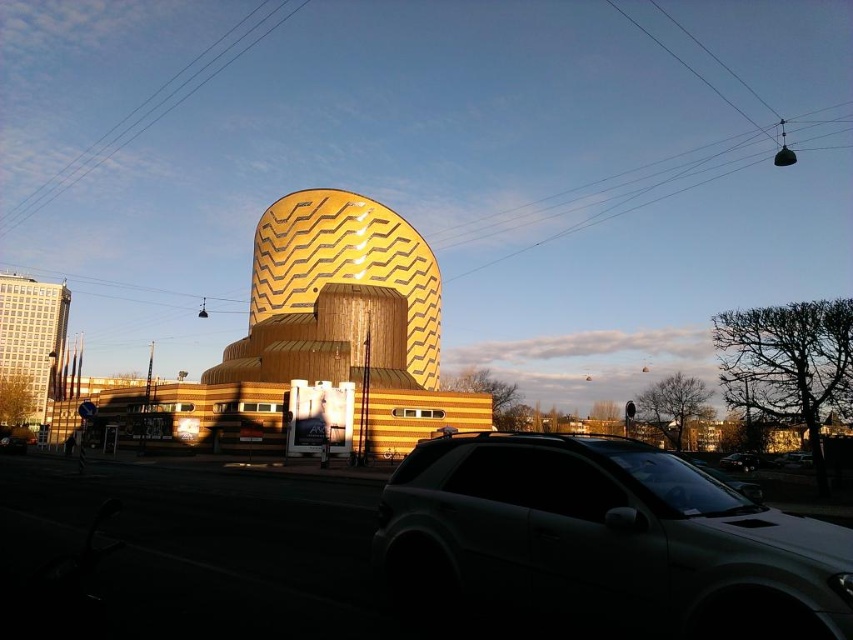
Question: Considering the real-world distances, which object is farthest from the gold textured dome at center?

Choices:
 (A) matte gray building at left
 (B) satin silver suv at center

Answer: (A)

Question: Does matte black suv at lower right appear over satin black suv at center?

Choices:
 (A) no
 (B) yes

Answer: (B)

Question: Does gold textured dome at center appear on the right side of satin silver suv at center?

Choices:
 (A) no
 (B) yes

Answer: (A)

Question: Which of the following is the closest to the observer?

Choices:
 (A) gold textured dome at center
 (B) satin silver suv at center
 (C) matte black suv at lower right
 (D) satin black suv at center

Answer: (C)

Question: Which point is closer to the camera taking this photo?

Choices:
 (A) (584, 500)
 (B) (20, 340)

Answer: (A)

Question: Considering the relative positions of matte black suv at lower right and matte gray building at left in the image provided, where is matte black suv at lower right located with respect to matte gray building at left?

Choices:
 (A) below
 (B) above

Answer: (A)